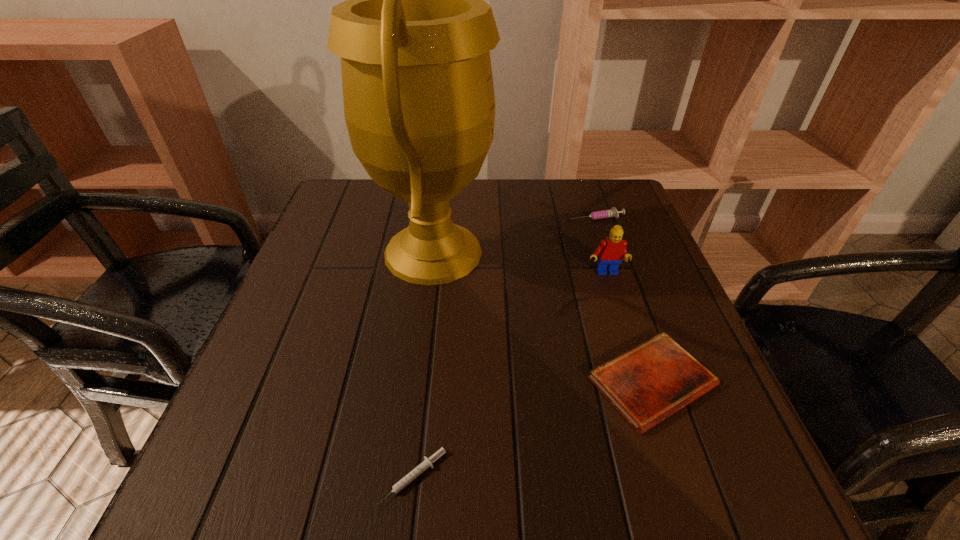
Locate an element on the screen. The height and width of the screenshot is (540, 960). free space between the nearer syringe and the tallest object is located at coordinates (422, 365).

The height and width of the screenshot is (540, 960). What are the coordinates of `vacant region between the trophy and the nearest object` in the screenshot? It's located at (422, 365).

Where is `free point between the second shortest object and the trophy`? free point between the second shortest object and the trophy is located at coordinates (542, 317).

The image size is (960, 540). In order to click on empty space that is in between the tallest object and the second shortest object in this screenshot , I will do `click(542, 317)`.

Locate an element on the screen. This screenshot has height=540, width=960. free spot between the second shortest object and the fourth shortest object is located at coordinates (629, 328).

Image resolution: width=960 pixels, height=540 pixels. In order to click on empty location between the fourth tallest object and the trophy in this screenshot , I will do `click(542, 317)`.

This screenshot has width=960, height=540. Find the location of `empty space between the diary and the Lego`. empty space between the diary and the Lego is located at coordinates (629, 328).

Point out which object is positioned as the nearest to the right syringe. Please provide its 2D coordinates. Your answer should be formatted as a tuple, i.e. [(x, y)], where the tuple contains the x and y coordinates of a point satisfying the conditions above.

[(612, 250)]

Where is `object that is the second nearest to the tallest object`? The width and height of the screenshot is (960, 540). object that is the second nearest to the tallest object is located at coordinates pos(613,212).

The height and width of the screenshot is (540, 960). What are the coordinates of `free space that satisfies the following two spatial constraints: 1. on the back side of the taller syringe; 2. on the right side of the fourth tallest object` in the screenshot? It's located at (596, 218).